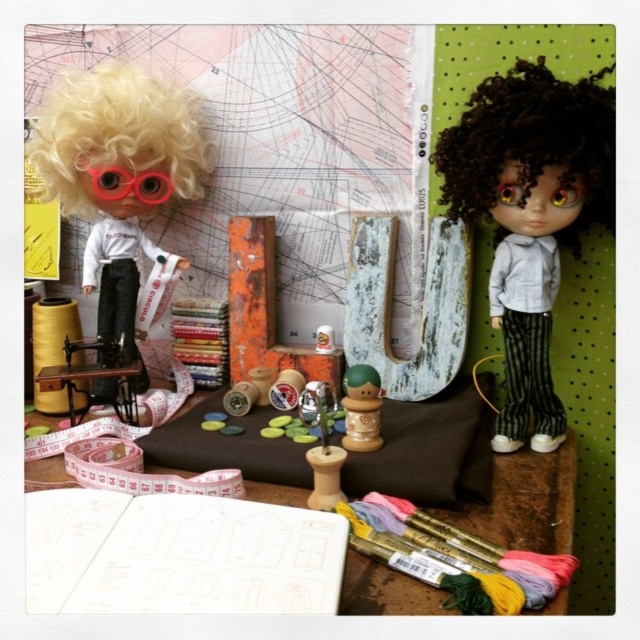
Does matte gray doll at center have a greater height compared to white paper at center?

Yes.

Who is lower down, matte gray doll at center or white paper at center?

white paper at center is below.

Is point (509, 262) closer to viewer compared to point (508, 502)?

No, it is not.

I want to click on matte gray doll at center, so click(x=531, y=209).

Is point (163, 113) closer to viewer compared to point (355, 440)?

That is False.

Does blonde curly wig at upper left appear under wooden toy at center?

No, blonde curly wig at upper left is not below wooden toy at center.

Is point (204, 172) positioned after point (344, 378)?

That is True.

You are a GUI agent. You are given a task and a screenshot of the screen. Output one action in this format:
    pyautogui.click(x=<x>, y=<y>)
    Task: Click on the blonde curly wig at upper left
    The height and width of the screenshot is (640, 640).
    Given the screenshot: What is the action you would take?
    pyautogui.click(x=120, y=141)

Does matte black doll at left appear on the left side of rubberized plastic goggles at upper left?

Yes, matte black doll at left is to the left of rubberized plastic goggles at upper left.

Does point (150, 188) come closer to viewer compared to point (141, 170)?

No, it is not.

Find the location of `matte black doll at left`. matte black doll at left is located at coordinates (118, 170).